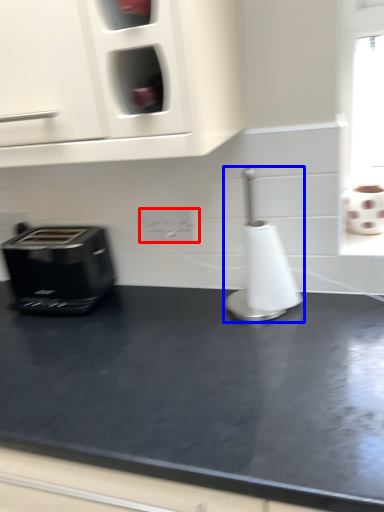
Question: Which object is closer to the camera taking this photo, electric outlet (highlighted by a red box) or appliance (highlighted by a blue box)?

Choices:
 (A) electric outlet
 (B) appliance

Answer: (B)